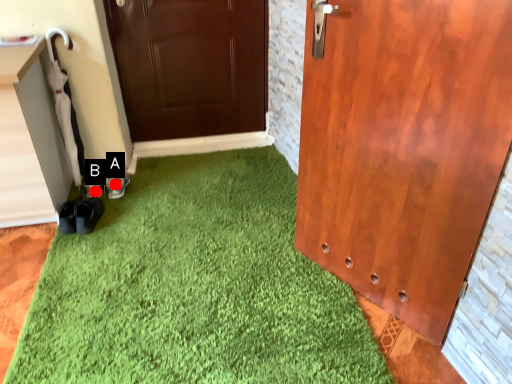
Question: Two points are circled on the image, labeled by A and B beside each circle. Which point is closer to the camera?

Choices:
 (A) A is closer
 (B) B is closer

Answer: (B)